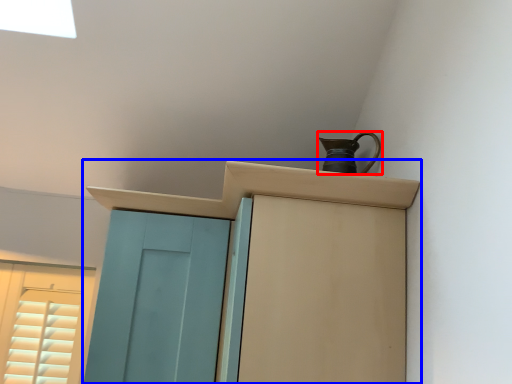
Question: Which object is further to the camera taking this photo, jug (highlighted by a red box) or cupboard (highlighted by a blue box)?

Choices:
 (A) jug
 (B) cupboard

Answer: (A)